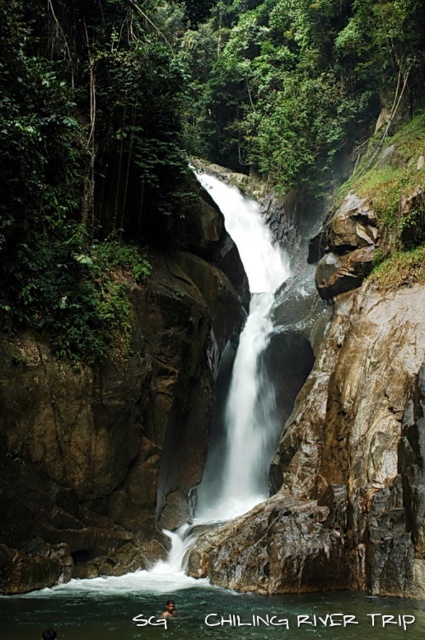
Question: From the image, what is the correct spatial relationship of clear water at center in relation to brown textured hair at center?

Choices:
 (A) below
 (B) above

Answer: (A)

Question: Among these points, which one is nearest to the camera?

Choices:
 (A) click(48, 636)
 (B) click(240, 346)

Answer: (A)

Question: Which object is positioned farthest from the brown textured hair at center?

Choices:
 (A) dark skin human at center
 (B) clear water at center

Answer: (A)

Question: Does clear water at center lie in front of brown textured hair at center?

Choices:
 (A) no
 (B) yes

Answer: (B)

Question: In this image, where is brown textured hair at center located relative to dark skin human at center?

Choices:
 (A) below
 (B) above

Answer: (A)

Question: Which point appears farthest from the camera in this image?

Choices:
 (A) (232, 365)
 (B) (164, 616)
 (C) (48, 634)
 (D) (33, 637)

Answer: (A)